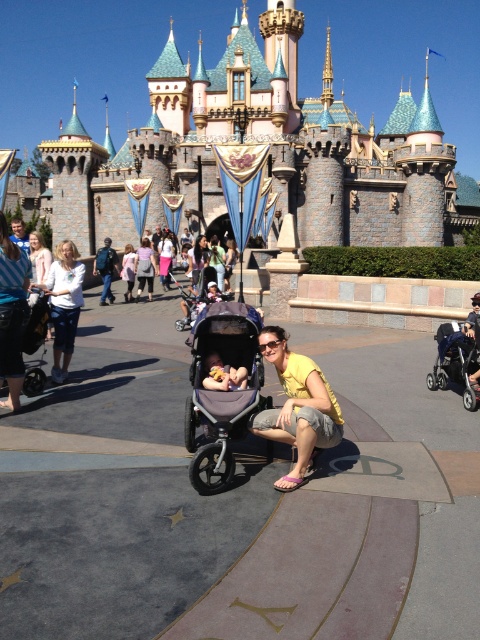
Question: Is matte white shirt at center thinner than matte pink shirt at center?

Choices:
 (A) no
 (B) yes

Answer: (B)

Question: Which of the following is the farthest from the observer?

Choices:
 (A) yellow cotton shirt at center
 (B) matte white shirt at center
 (C) white cotton shirt at center
 (D) soft pink fabric at center

Answer: (C)

Question: Which point appears farthest from the camera in this image?

Choices:
 (A) (279, 360)
 (B) (250, 364)
 (C) (0, 241)
 (D) (142, 260)

Answer: (D)

Question: Does yellow cotton shirt at center have a larger size compared to matte white shirt at center?

Choices:
 (A) no
 (B) yes

Answer: (B)

Question: Does gray fabric stroller at center have a lesser width compared to matte pink shirt at center?

Choices:
 (A) no
 (B) yes

Answer: (A)

Question: Which of the following is the closest to the observer?

Choices:
 (A) (324, 381)
 (B) (67, 346)
 (C) (243, 369)

Answer: (A)